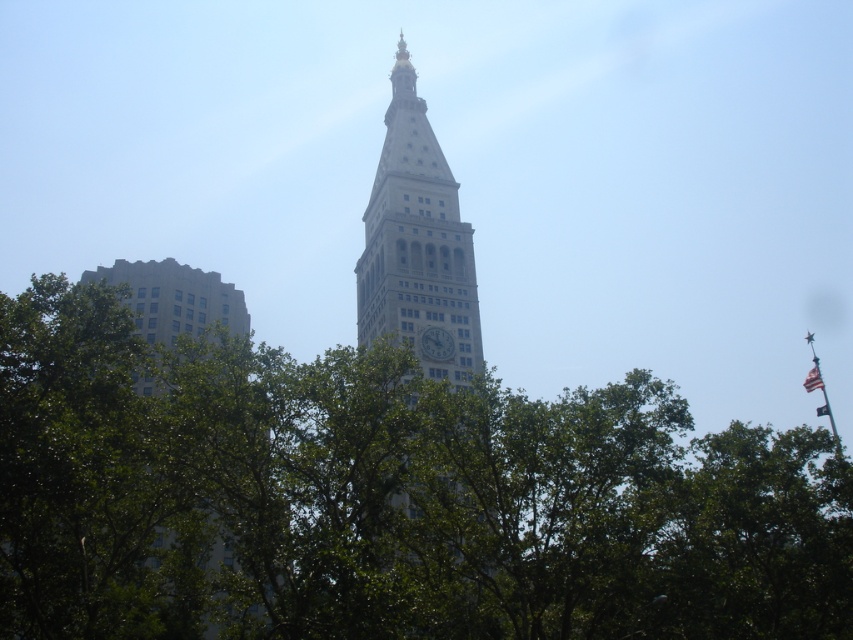
You are standing in a park and see the white stone clock tower at center and the american flag at right. Which object is closer to you?

The american flag at right is closer to you because the white stone clock tower at center is positioned over it, meaning the tower is behind the flag.

You are standing in front of the historic tower and notice two points marked on the tower. The first point is at coordinates point (389, 179) and the second is at point (827, 412). Which point is closer to your current position?

Point (389, 179) is closer to the camera than point (827, 412), so the first point is closer to your current position.

You are standing in front of the historic tower and notice two american flags. One is labeled as the american flag at right and the other as the american flag at upper right. From your perspective, which flag is positioned to the left of the other?

The american flag at right is to the left of the american flag at upper right according to the description.